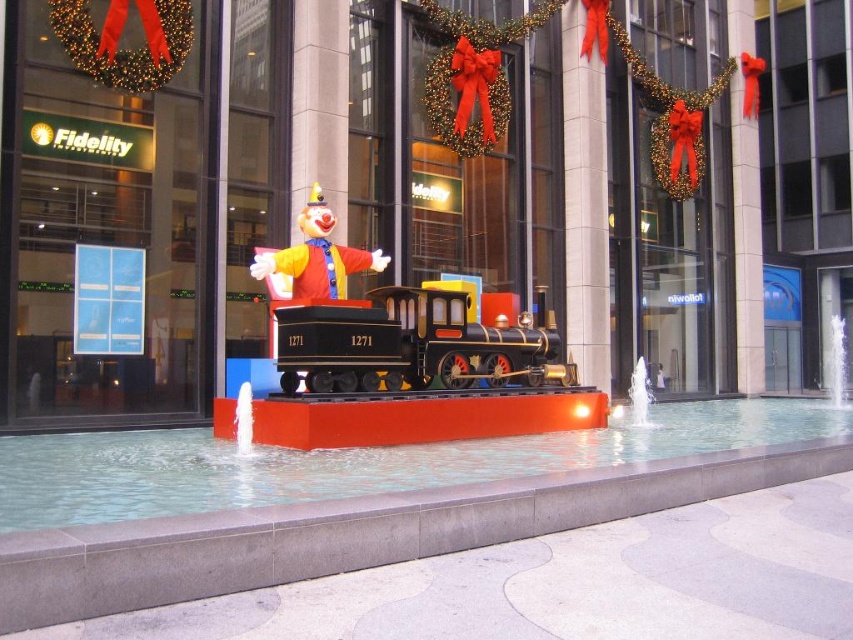
Question: Which object is closer to the camera taking this photo?

Choices:
 (A) clear glass water at center
 (B) metallic gold pillar at upper right

Answer: (A)

Question: Is metallic gold pillar at upper right to the right of clear glass water at center from the viewer's perspective?

Choices:
 (A) no
 (B) yes

Answer: (B)

Question: Which of these objects is positioned farthest from the metallic gold pillar at upper right?

Choices:
 (A) metallic clown at center
 (B) clear glass water at center
 (C) white marble pillar at center
 (D) matte clown at center

Answer: (D)

Question: Which object is farther from the camera taking this photo?

Choices:
 (A) metallic gold pillar at upper right
 (B) matte clown at center
 (C) white marble pillar at center
 (D) clear glass water at center

Answer: (A)

Question: Can you confirm if white marble pillar at center is thinner than clear glass water at center?

Choices:
 (A) no
 (B) yes

Answer: (B)

Question: Can you confirm if shiny black locomotive at center is positioned to the left of matte clown at center?

Choices:
 (A) no
 (B) yes

Answer: (A)